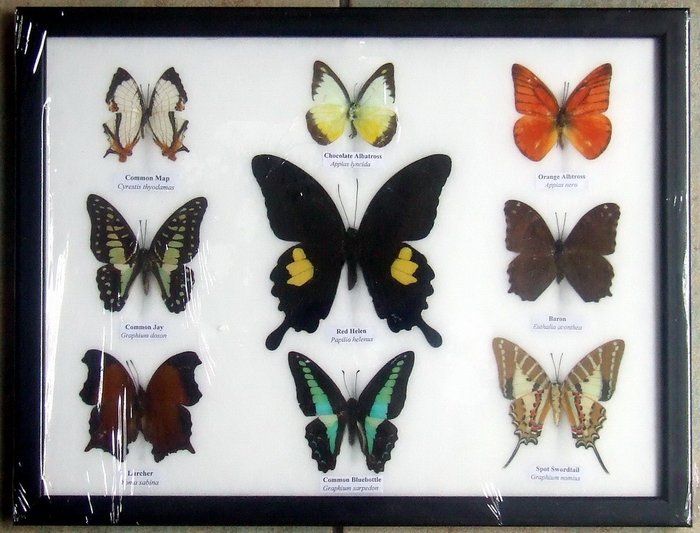
Locate an element on the screen. corner is located at coordinates (690, 7), (8, 12), (21, 516), (682, 520).